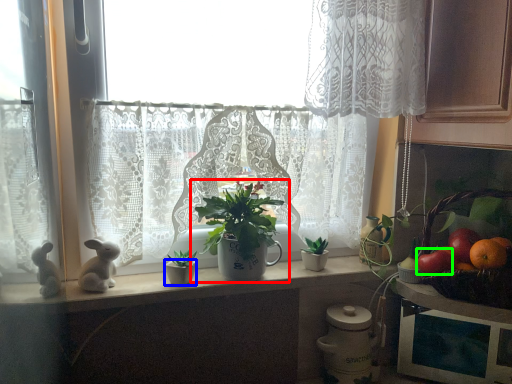
Question: Considering the real-world distances, which object is farthest from houseplant (highlighted by a red box)? flowerpot (highlighted by a blue box) or fruit (highlighted by a green box)?

Choices:
 (A) flowerpot
 (B) fruit

Answer: (B)